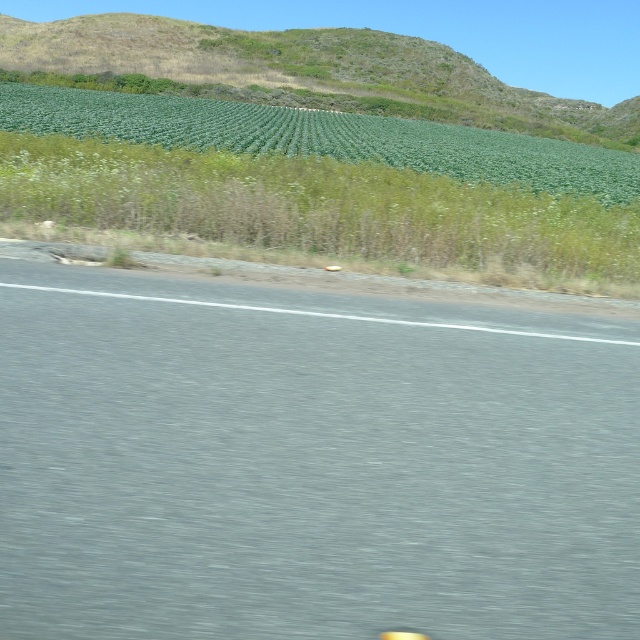
You are a driver approaching the green grassy hill at upper center and the green leafy plants at upper center. Which of these two objects would appear closer to you as you drive forward?

The green grassy hill at upper center appears closer because it is larger in size than the green leafy plants at upper center.

You are a driver approaching the gray asphalt road at center and the green leafy plants at upper center. Which one takes up more visual space in the image?

The green leafy plants at upper center occupy more space than the gray asphalt road at center in the image.